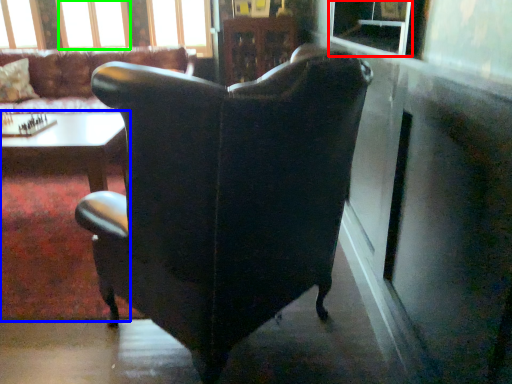
Question: Which is nearer to the window screen (highlighted by a red box)? table (highlighted by a blue box) or window (highlighted by a green box).

Choices:
 (A) table
 (B) window

Answer: (A)